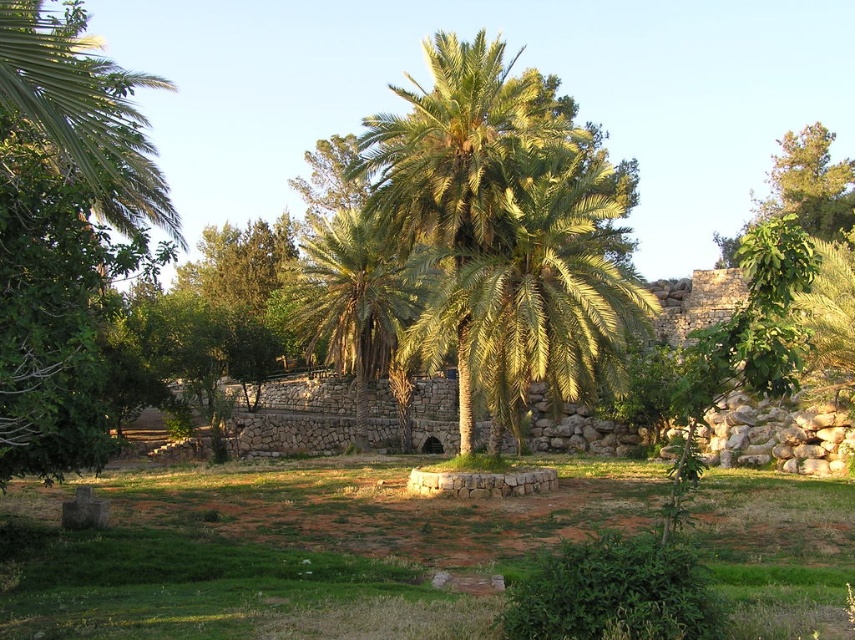
Identify the location of green leafy palm at center. (535, 288).

You are a GUI agent. You are given a task and a screenshot of the screen. Output one action in this format:
    pyautogui.click(x=<x>, y=<y>)
    Task: Click on the green leafy palm at center
    The height and width of the screenshot is (640, 855).
    Given the screenshot: What is the action you would take?
    pyautogui.click(x=535, y=288)

In the scene shown: Can you confirm if green leafy tree at left is taller than green leafy palm tree at center?

In fact, green leafy tree at left may be shorter than green leafy palm tree at center.

Is green leafy tree at left above green leafy palm tree at center?

Indeed, green leafy tree at left is positioned over green leafy palm tree at center.

This screenshot has height=640, width=855. What do you see at coordinates (65, 234) in the screenshot?
I see `green leafy tree at left` at bounding box center [65, 234].

Identify the location of green leafy tree at left. This screenshot has width=855, height=640. (65, 234).

Can you confirm if green leafy tree at left is positioned below green leafy palm at center?

Correct, green leafy tree at left is located below green leafy palm at center.

Locate an element on the screen. The width and height of the screenshot is (855, 640). green leafy tree at left is located at coordinates [65, 234].